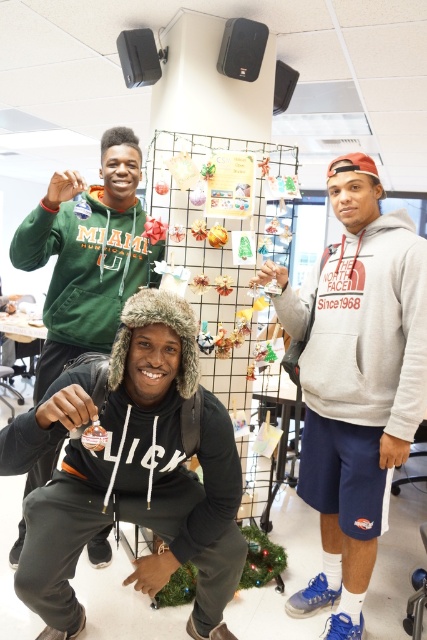
Question: Where is gray fleece hoodie at center located in relation to metallic wire mesh at center in the image?

Choices:
 (A) left
 (B) right

Answer: (B)

Question: Which object is closer to the camera taking this photo?

Choices:
 (A) metallic wire mesh at center
 (B) gray fleece hoodie at center

Answer: (B)

Question: Can you confirm if black fuzzy hat at lower left is wider than gray fleece hoodie at right?

Choices:
 (A) no
 (B) yes

Answer: (B)

Question: Is gray fleece hoodie at right in front of matte black hoodie at center?

Choices:
 (A) no
 (B) yes

Answer: (B)

Question: Based on their relative distances, which object is farther from the metallic wire mesh at center?

Choices:
 (A) gray fleece hoodie at right
 (B) black fuzzy hat at lower left
 (C) matte black hoodie at center
 (D) gray fleece hoodie at center

Answer: (B)

Question: Which object appears closest to the camera in this image?

Choices:
 (A) gray fleece hoodie at center
 (B) black fuzzy hat at lower left

Answer: (B)